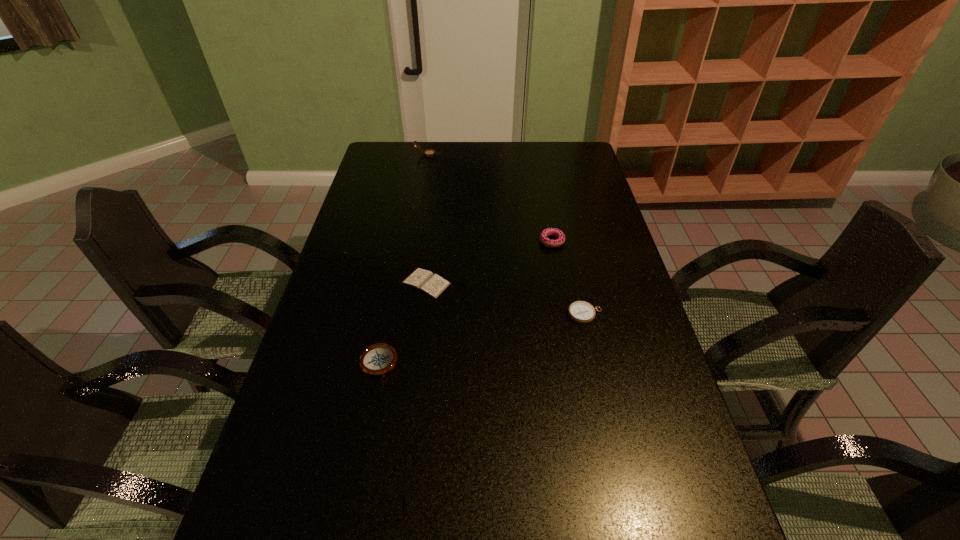
The width and height of the screenshot is (960, 540). Identify the location of vacant space located on the face of the farthest object. (479, 154).

Where is `free space located 0.340m on the left of the doughnut`? The image size is (960, 540). free space located 0.340m on the left of the doughnut is located at coordinates (435, 241).

The image size is (960, 540). In order to click on vacant space situated 0.060m on the back of the nearest object in this screenshot , I will do `click(386, 328)`.

At what (x,y) coordinates should I click in order to perform the action: click on vacant space situated on the front of the second farthest compass. Please return your answer as a coordinate pair (x, y). The image size is (960, 540). Looking at the image, I should click on (616, 452).

Locate an element on the screen. The width and height of the screenshot is (960, 540). free spot located 0.200m on the right of the shortest object is located at coordinates (519, 284).

Locate an element on the screen. This screenshot has height=540, width=960. object positioned at the far edge is located at coordinates (428, 153).

Locate an element on the screen. This screenshot has width=960, height=540. object at the left edge is located at coordinates (378, 359).

You are a GUI agent. You are given a task and a screenshot of the screen. Output one action in this format:
    pyautogui.click(x=<x>, y=<y>)
    Task: Click on the object that is at the right edge
    This screenshot has height=540, width=960.
    Given the screenshot: What is the action you would take?
    pyautogui.click(x=582, y=312)

Locate an element on the screen. vacant position at the far edge of the desktop is located at coordinates (461, 146).

Where is `blank space at the left edge of the desktop`? This screenshot has width=960, height=540. blank space at the left edge of the desktop is located at coordinates (375, 268).